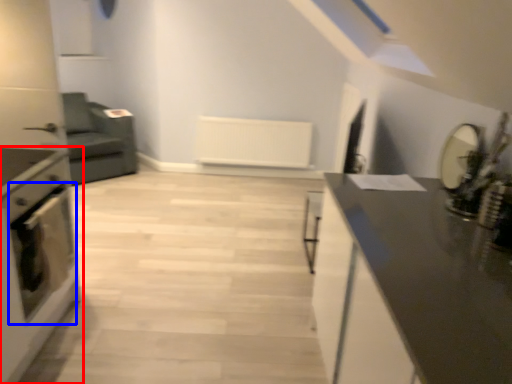
Question: Which point is further to the camera, home appliance (highlighted by a red box) or oven (highlighted by a blue box)?

Choices:
 (A) home appliance
 (B) oven

Answer: (B)